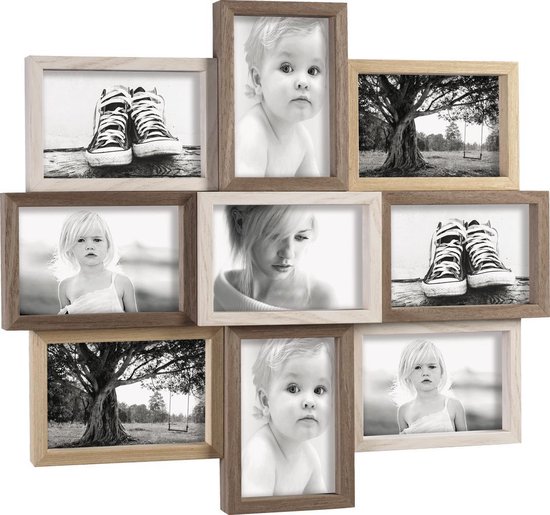
Image resolution: width=550 pixels, height=515 pixels. In order to click on portraits in this screenshot , I will do `click(427, 351)`, `click(286, 392)`, `click(101, 392)`, `click(102, 283)`, `click(280, 281)`, `click(436, 281)`, `click(443, 147)`, `click(260, 121)`, `click(133, 120)`.